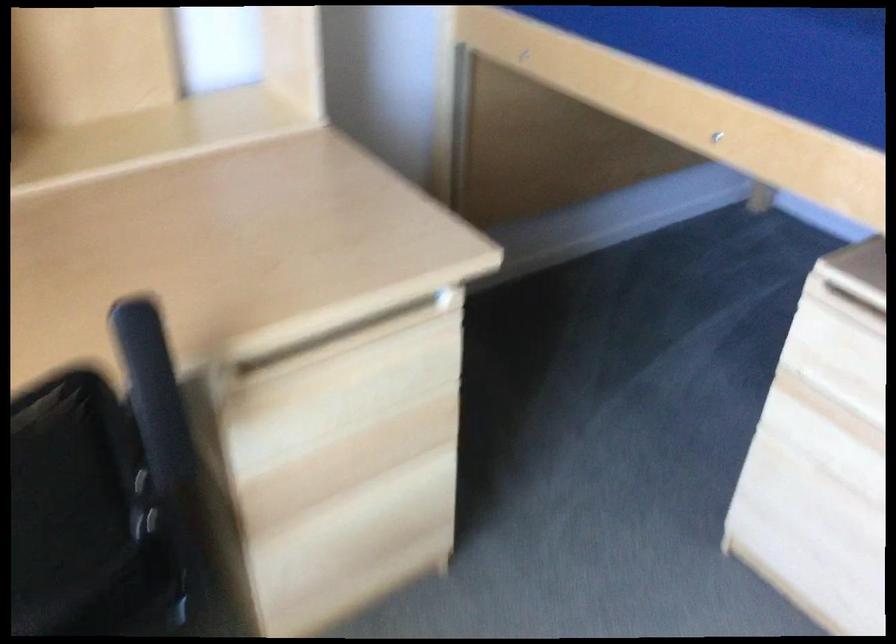
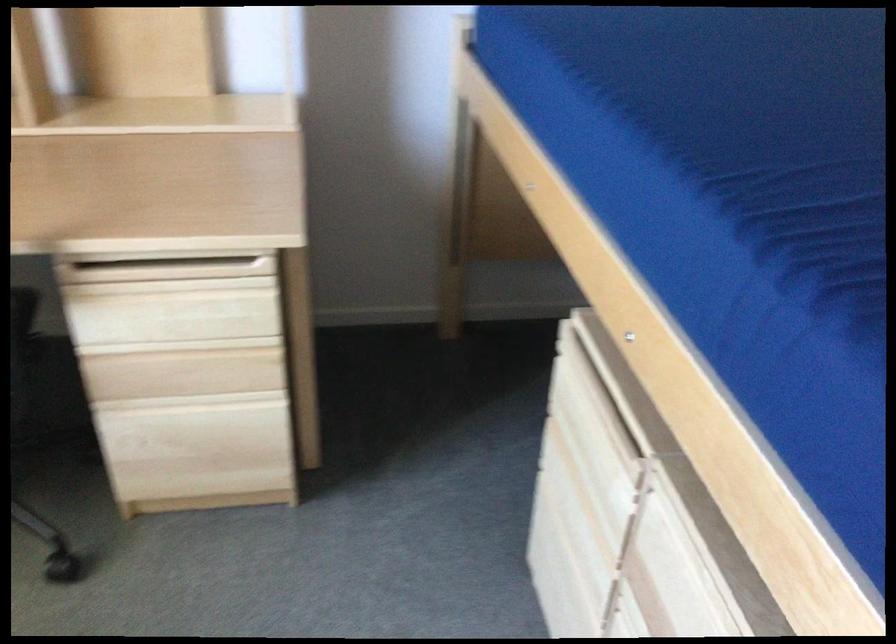
Where in the second image is the point corresponding to (x=376, y=550) from the first image?

(202, 460)